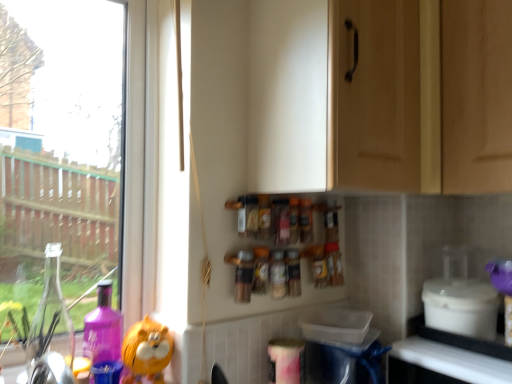
Question: Is white plastic container at lower right situated inside white glossy counter top at lower right or outside?

Choices:
 (A) outside
 (B) inside

Answer: (A)

Question: Is point (456, 301) positioned closer to the camera than point (395, 342)?

Choices:
 (A) farther
 (B) closer

Answer: (B)

Question: Which is nearer to the purple glossy bottle at left?

Choices:
 (A) translucent plastic spice jar at center, placed as the 2th bottle when sorted from right to left
 (B) white plastic container at lower right
 (C) white glossy counter top at lower right
 (D) translucent plastic spice jar at center, marked as the first bottle in a right-to-left arrangement
 (E) orange matte plush toy at lower left

Answer: (E)

Question: Which of these objects is positioned closest to the translucent plastic spice jar at center, placed as the 2th bottle when sorted from right to left?

Choices:
 (A) purple glossy bottle at left
 (B) translucent plastic spice jar at center, the first bottle from the left
 (C) white plastic container at lower right
 (D) matte wood cabinet at upper center
 (E) white glossy counter top at lower right

Answer: (B)